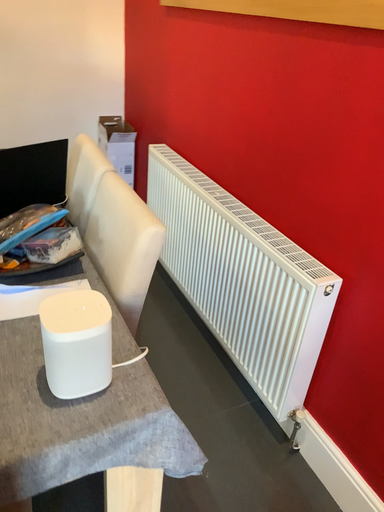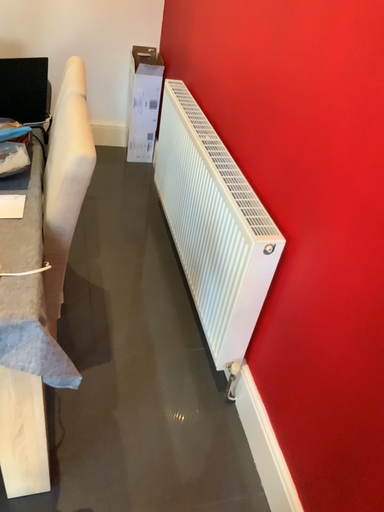
Question: Which way did the camera rotate in the video?

Choices:
 (A) rotated right
 (B) rotated left

Answer: (B)